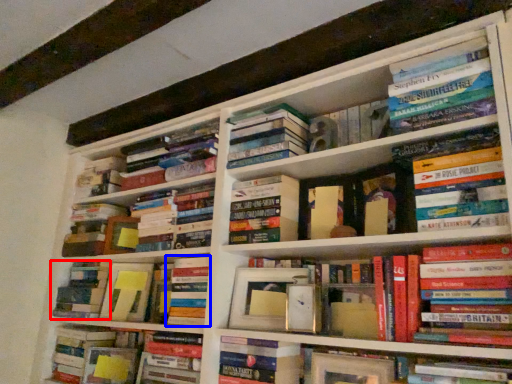
Question: Which point is closer to the camera, book (highlighted by a red box) or book (highlighted by a blue box)?

Choices:
 (A) book
 (B) book

Answer: (B)